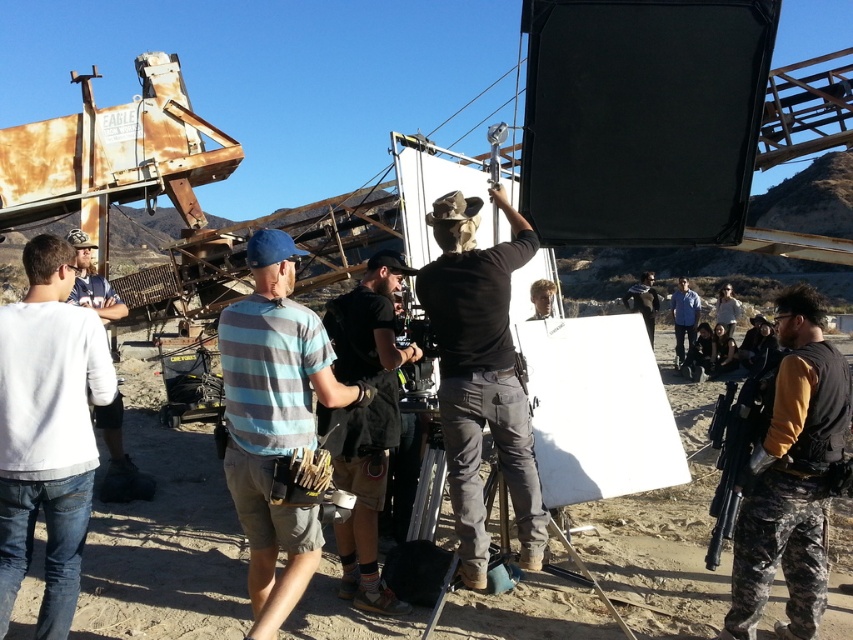
You are part of the film crew on the desert set and need to locate the white matte shirt at left for an urgent equipment adjustment. Based on the coordinates provided, can you confirm its position relative to the other crew members?

The white matte shirt at left is located at point coordinates (91, 282), which places it in the left section of the scene.

You are a costume designer checking the wardrobe for a desert film scene. You need to determine which clothing item is more suitable for the sandy environment based on their sizes. Which one is smaller between the camouflage pants at center and the dark gray fabric jacket at center?

The camouflage pants at center has a smaller size compared to the dark gray fabric jacket at center, so the camouflage pants at center would be the more suitable option for the sandy environment as it is smaller in size.

You are a costume designer reviewing the film set. You need to determine which clothing item is shorter between the white matte shirt at left and the dark gray fabric jacket at center. Which one is shorter?

The white matte shirt at left is shorter than the dark gray fabric jacket at center.